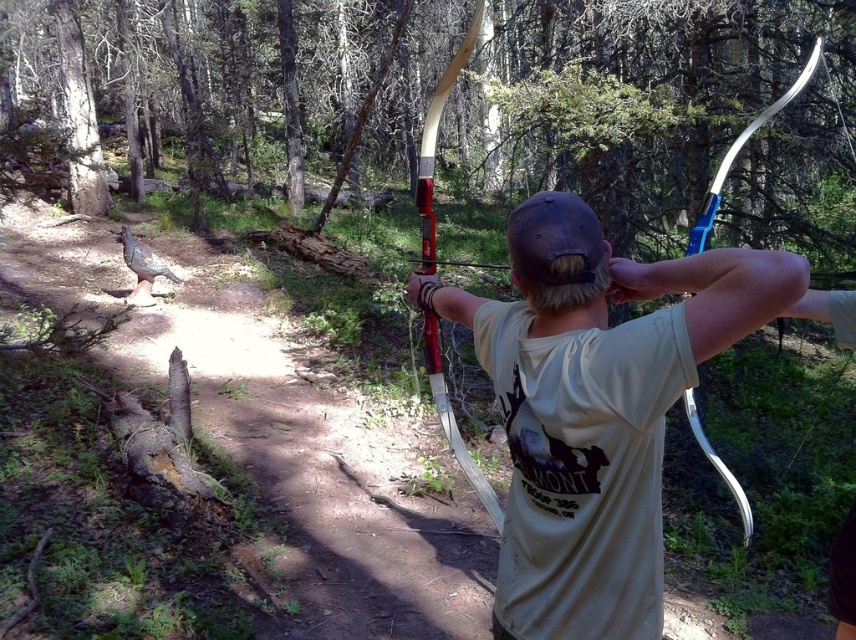
Can you confirm if matte white t-shirt at center is shorter than wooden bow at center?

Yes, matte white t-shirt at center is shorter than wooden bow at center.

Which of these two, matte white t-shirt at center or wooden bow at center, stands shorter?

matte white t-shirt at center

Image resolution: width=856 pixels, height=640 pixels. Find the location of `matte white t-shirt at center`. matte white t-shirt at center is located at coordinates (595, 406).